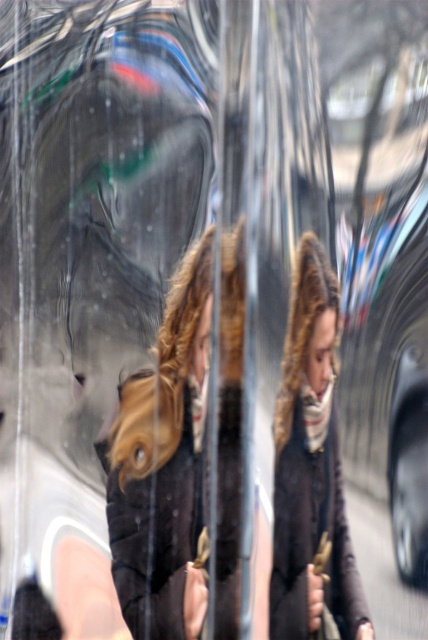
Who is more forward, (140, 484) or (321, 579)?

Point (321, 579)

Is dark brown leather jacket at center taller than dark brown wool coat at center?

Yes, dark brown leather jacket at center is taller than dark brown wool coat at center.

Is point (225, 573) in front of point (368, 618)?

That is False.

Image resolution: width=428 pixels, height=640 pixels. I want to click on dark brown leather jacket at center, so click(165, 465).